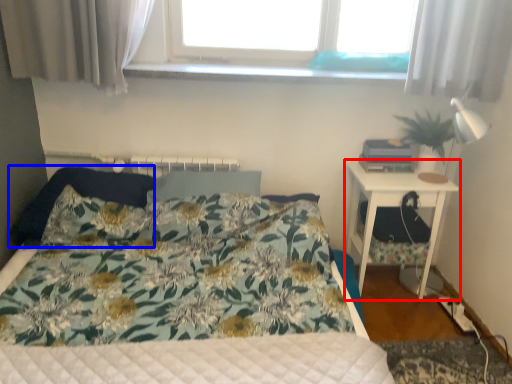
Question: Among these objects, which one is farthest to the camera, nightstand (highlighted by a red box) or pillow (highlighted by a blue box)?

Choices:
 (A) nightstand
 (B) pillow

Answer: (A)